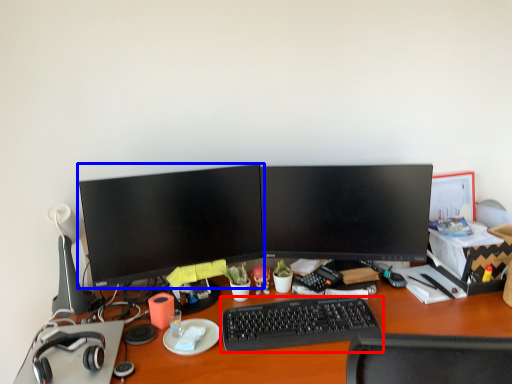
Question: Which object is closer to the camera taking this photo, computer keyboard (highlighted by a red box) or computer monitor (highlighted by a blue box)?

Choices:
 (A) computer keyboard
 (B) computer monitor

Answer: (A)